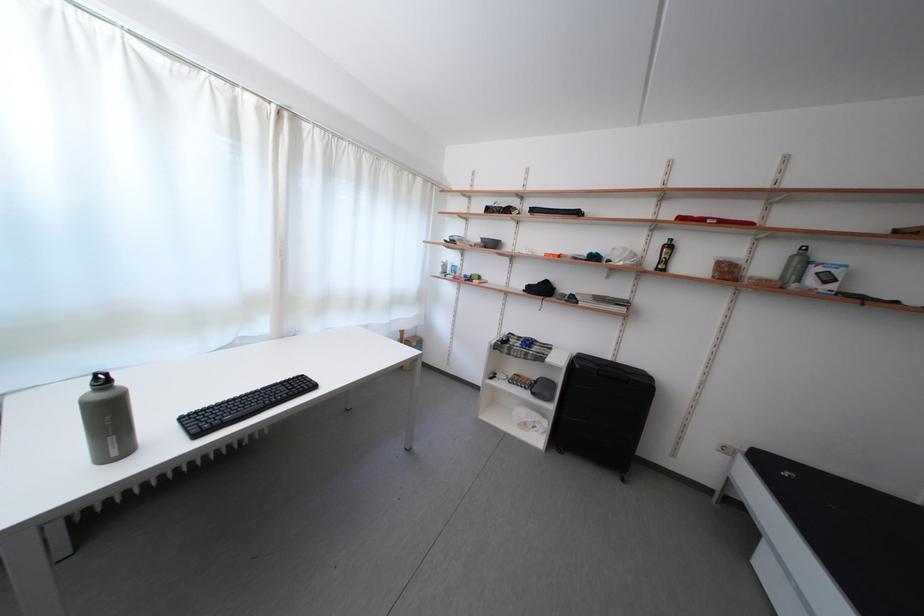
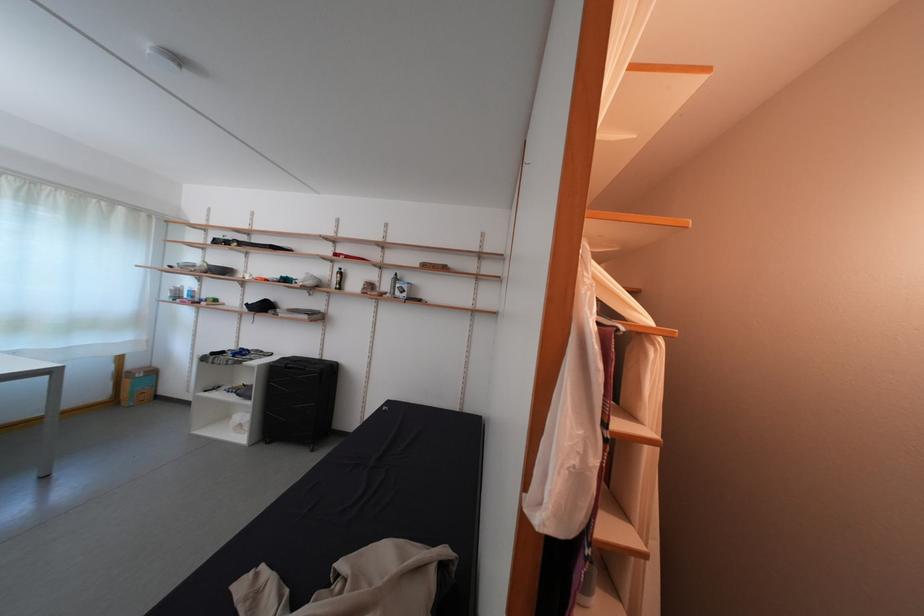
In a continuous first-person perspective shot, in which direction is the camera moving?

The cameraman walked toward right, backward.